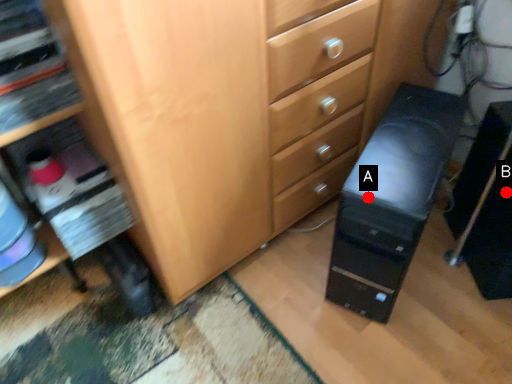
Question: Two points are circled on the image, labeled by A and B beside each circle. Among these points, which one is farthest from the camera?

Choices:
 (A) A is further
 (B) B is further

Answer: (B)